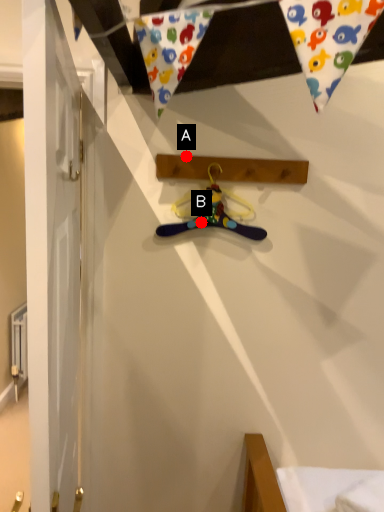
Question: Two points are circled on the image, labeled by A and B beside each circle. Which point is closer to the camera?

Choices:
 (A) A is closer
 (B) B is closer

Answer: (A)